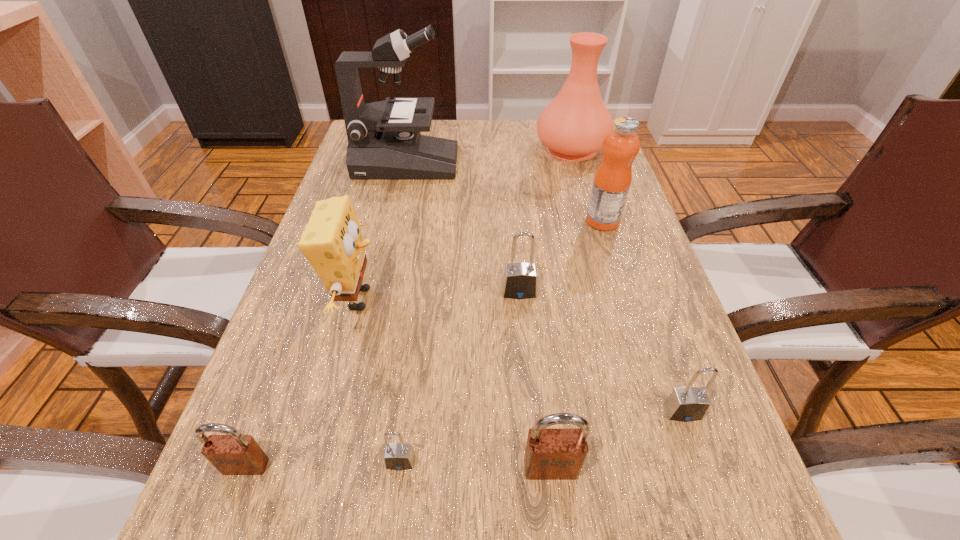
The width and height of the screenshot is (960, 540). Identify the location of the leftmost padlock. (233, 454).

This screenshot has height=540, width=960. Identify the location of the smaller brown padlock. (233, 454).

This screenshot has width=960, height=540. What are the coordinates of `the shortest object` in the screenshot? It's located at (398, 456).

The height and width of the screenshot is (540, 960). What are the coordinates of `the nearest gray padlock` in the screenshot? It's located at (398, 456).

You are a GUI agent. You are given a task and a screenshot of the screen. Output one action in this format:
    pyautogui.click(x=<x>, y=<y>)
    Task: Click on the free region located 0.270m through the eyepieces of the microscope
    Image resolution: width=960 pixels, height=540 pixels.
    Given the screenshot: What is the action you would take?
    pyautogui.click(x=556, y=164)

Locate an element on the screen. The image size is (960, 540). vacant space located on the left of the second tallest object is located at coordinates click(417, 148).

Locate an element on the screen. free space located on the front of the fruit juice is located at coordinates (624, 290).

Image resolution: width=960 pixels, height=540 pixels. Identify the location of blank area located 0.090m on the face of the sixth shortest object. (430, 299).

Where is `free point located 0.170m on the shackle of the farthest padlock`? The height and width of the screenshot is (540, 960). free point located 0.170m on the shackle of the farthest padlock is located at coordinates coord(526,376).

At what (x,y) coordinates should I click in order to perform the action: click on vacant space situated 0.130m on the shackle of the sixth farthest object. Please return your answer as a coordinate pair (x, y). This screenshot has width=960, height=540. Looking at the image, I should click on (719, 515).